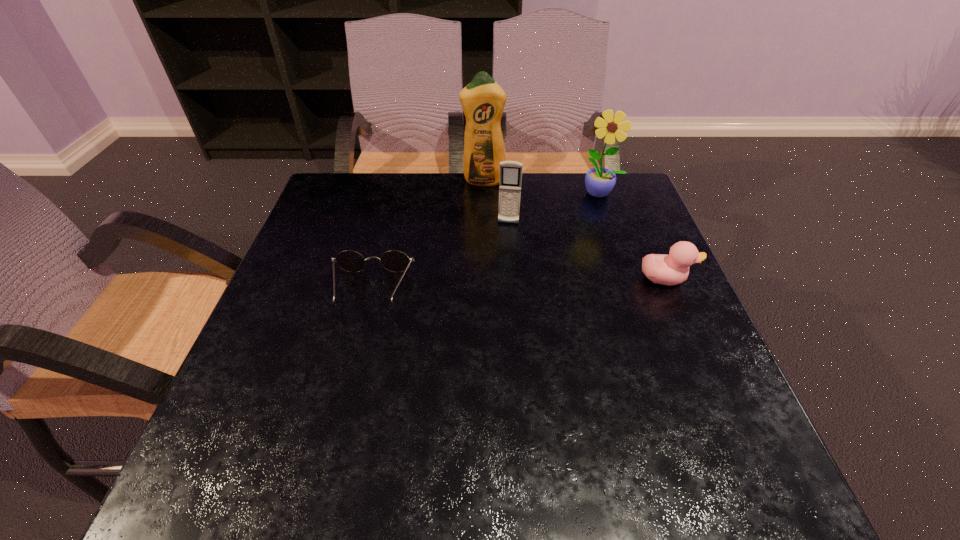
Locate an element on the screen. The image size is (960, 540). object that is at the left edge is located at coordinates (395, 261).

At what (x,y) coordinates should I click in order to perform the action: click on duckling that is at the right edge. Please return your answer as a coordinate pair (x, y). This screenshot has height=540, width=960. Looking at the image, I should click on (672, 269).

Where is `sunflower positioned at the right edge`? The width and height of the screenshot is (960, 540). sunflower positioned at the right edge is located at coordinates (599, 181).

Where is `object present at the far right corner`? object present at the far right corner is located at coordinates (599, 181).

In the image, there is a desktop. Find the location of `vacant space at the far edge`. vacant space at the far edge is located at coordinates (454, 204).

You are a GUI agent. You are given a task and a screenshot of the screen. Output one action in this format:
    pyautogui.click(x=<x>, y=<y>)
    Task: Click on the vacant space at the near edge of the desktop
    
    Given the screenshot: What is the action you would take?
    pyautogui.click(x=387, y=407)

You are a GUI agent. You are given a task and a screenshot of the screen. Output one action in this format:
    pyautogui.click(x=<x>, y=<y>)
    Task: Click on the free space at the left edge of the desktop
    Image resolution: width=960 pixels, height=540 pixels.
    Given the screenshot: What is the action you would take?
    pyautogui.click(x=321, y=327)

You are a GUI agent. You are given a task and a screenshot of the screen. Output one action in this format:
    pyautogui.click(x=<x>, y=<y>)
    Task: Click on the blank space at the right edge of the desktop
    The height and width of the screenshot is (540, 960).
    Given the screenshot: What is the action you would take?
    pyautogui.click(x=618, y=225)

The width and height of the screenshot is (960, 540). I want to click on vacant space at the far left corner of the desktop, so click(x=344, y=185).

Find the location of a particular element. free region at the near left corner of the desktop is located at coordinates (228, 403).